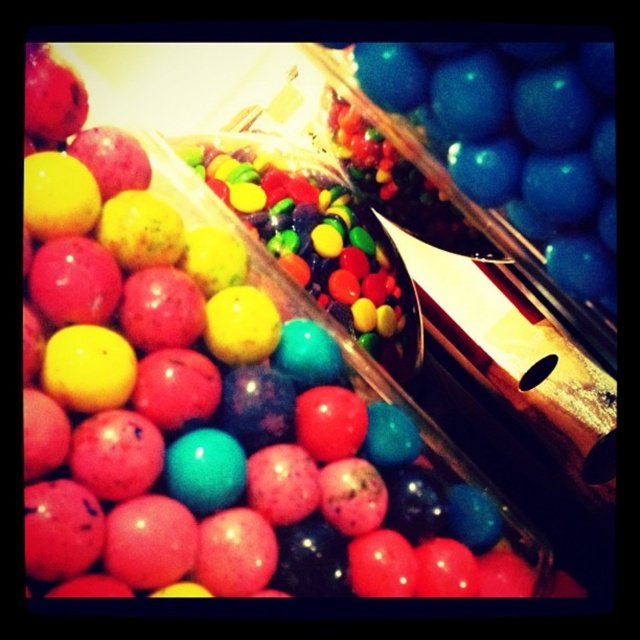
Question: Is blue glossy gumballs at upper right thinner than shiny multicolored candies at center?

Choices:
 (A) yes
 (B) no

Answer: (A)

Question: Which object appears farthest from the camera in this image?

Choices:
 (A) shiny multicolored candies at center
 (B) blue glossy gumballs at upper right

Answer: (A)

Question: Does blue glossy gumballs at upper right appear under shiny multicolored candies at center?

Choices:
 (A) yes
 (B) no

Answer: (B)

Question: Is blue glossy gumballs at upper right bigger than shiny multicolored candies at center?

Choices:
 (A) yes
 (B) no

Answer: (B)

Question: Which point is farther to the camera?

Choices:
 (A) (358, 257)
 (B) (515, 128)

Answer: (A)